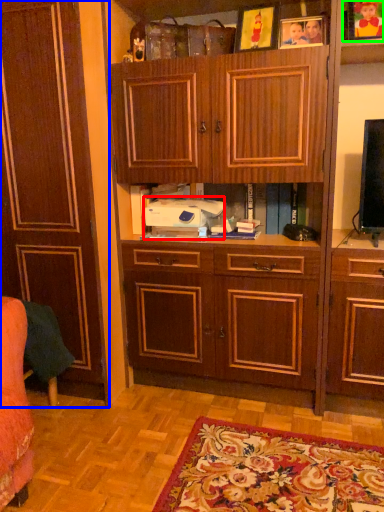
Question: Estimate the real-world distances between objects in this image. Which object is closer to printer (highlighted by a red box), cabinetry (highlighted by a blue box) or picture frame (highlighted by a green box)?

Choices:
 (A) cabinetry
 (B) picture frame

Answer: (A)